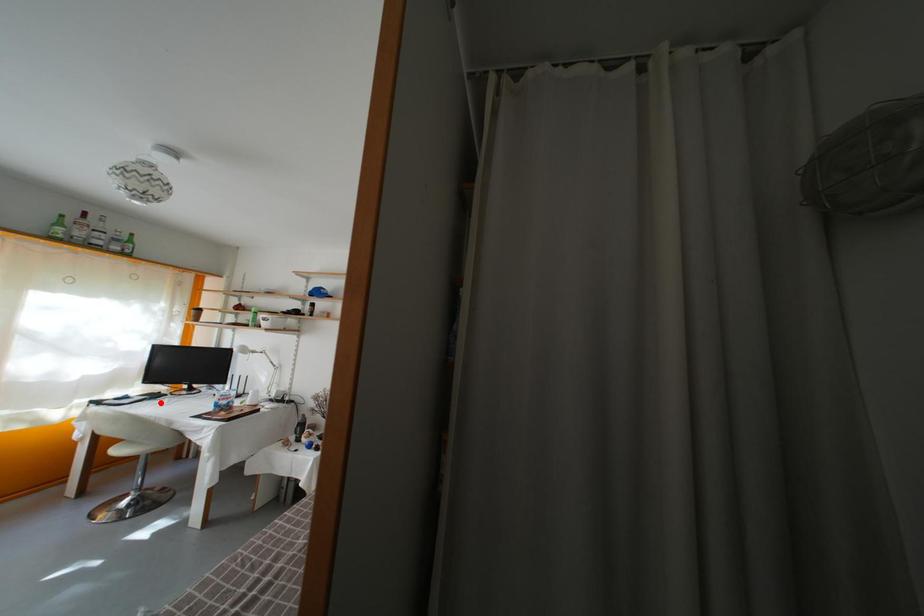
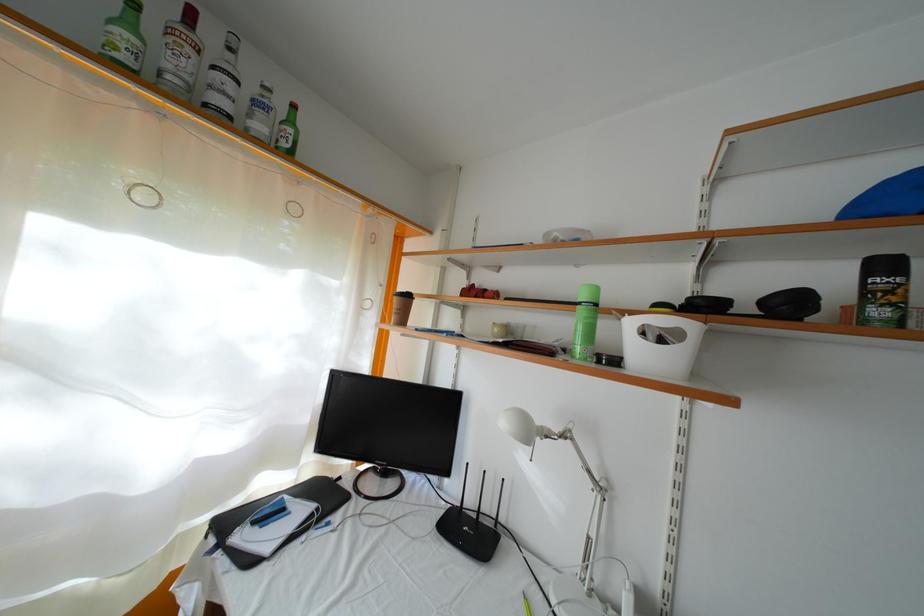
Where in the second image is the point corresponding to the highlighted location from the first image?

(334, 506)